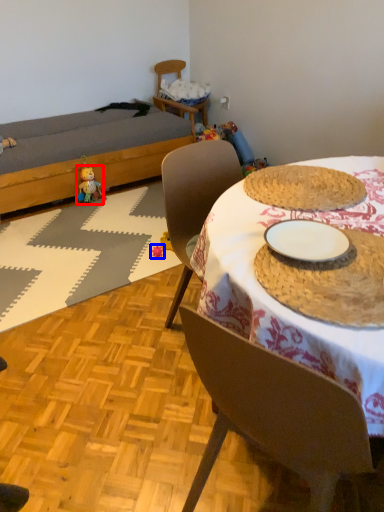
Question: Which object appears farthest to the camera in this image, toy (highlighted by a red box) or toy (highlighted by a blue box)?

Choices:
 (A) toy
 (B) toy

Answer: (A)